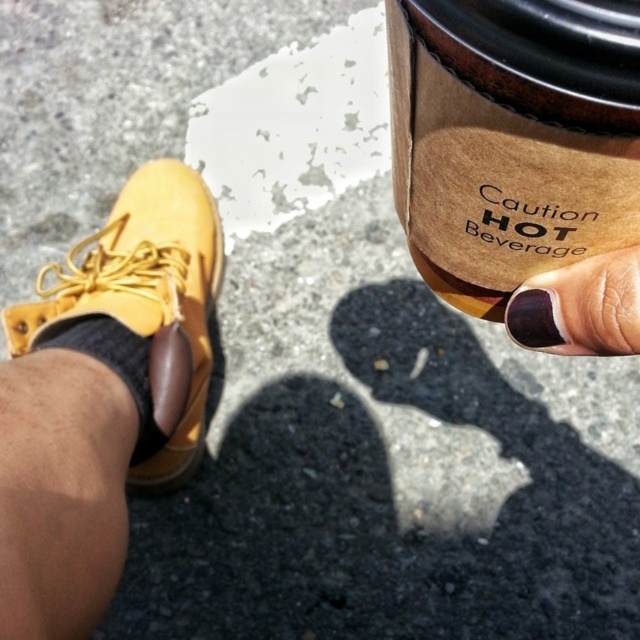
Which is below, brown suede cup at upper right or suede/yellow shoe at lower left?

Positioned lower is brown suede cup at upper right.

Is brown suede cup at upper right closer to the viewer compared to suede/yellow shoe at lower left?

Yes.

Which is in front, point (412, 102) or point (198, 368)?

Positioned in front is point (412, 102).

I want to click on brown suede cup at upper right, so click(x=513, y=138).

Is suede/yellow shoe at lower left thinner than dark purple nail polish at upper right?

Incorrect, suede/yellow shoe at lower left's width is not less than dark purple nail polish at upper right's.

In the scene shown: Who is lower down, suede/yellow shoe at lower left or dark purple nail polish at upper right?

dark purple nail polish at upper right

Identify the location of suede/yellow shoe at lower left. point(141,289).

Who is positioned more to the left, brown suede cup at upper right or dark purple nail polish at upper right?

brown suede cup at upper right is more to the left.

Is point (502, 204) closer to viewer compared to point (573, 305)?

Yes.

Identify the location of brown suede cup at upper right. This screenshot has width=640, height=640. (513, 138).